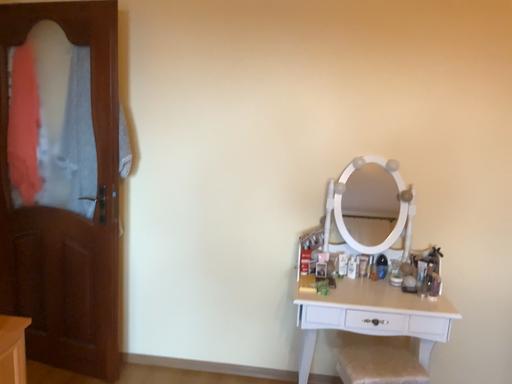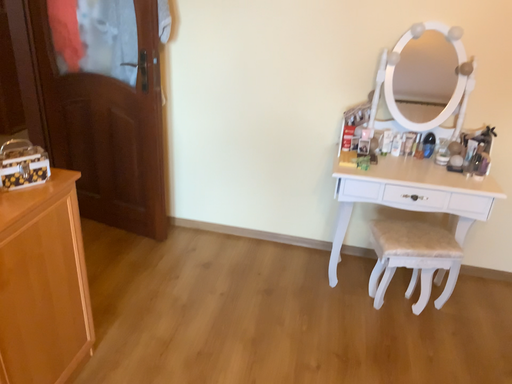
Question: How did the camera likely rotate when shooting the video?

Choices:
 (A) rotated upward
 (B) rotated downward

Answer: (B)